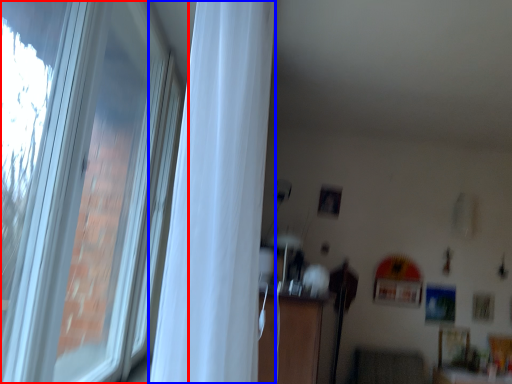
Question: Which object appears closest to the camera in this image, window (highlighted by a red box) or curtain (highlighted by a blue box)?

Choices:
 (A) window
 (B) curtain

Answer: (A)